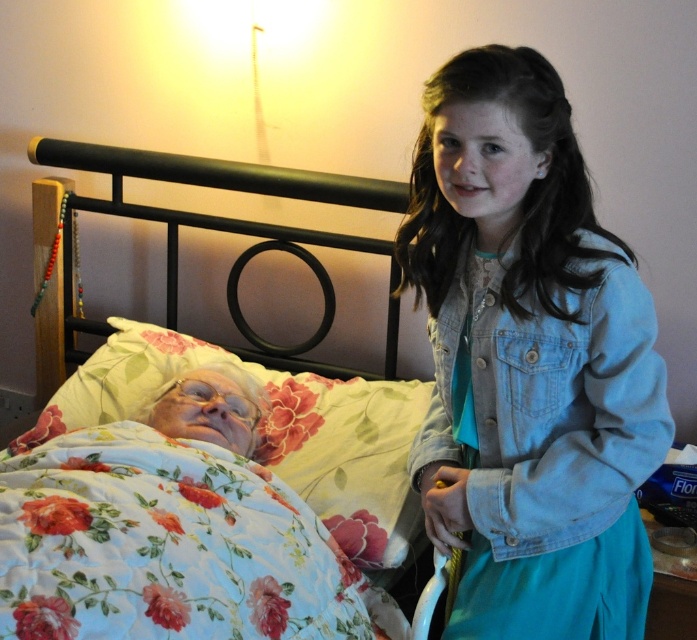
You are a nurse entering the bedroom to check on the elderly person. You see the floral cotton quilt at lower left and the metallic black bed at upper left. Which object is closer to the floor?

The floral cotton quilt at lower left is closer to the floor because it is located below the metallic black bed at upper left.

You are a nurse entering the bedroom and need to locate the denim jacket at right. Based on the coordinates provided in the Objects Description, can you determine if the jacket is closer to the bed or the door?

The denim jacket at right is located at point (528, 362). Since the coordinates are relative to the image frame, without knowing the exact position of the door, it is impossible to determine the jacket proximity to the bed or the door.